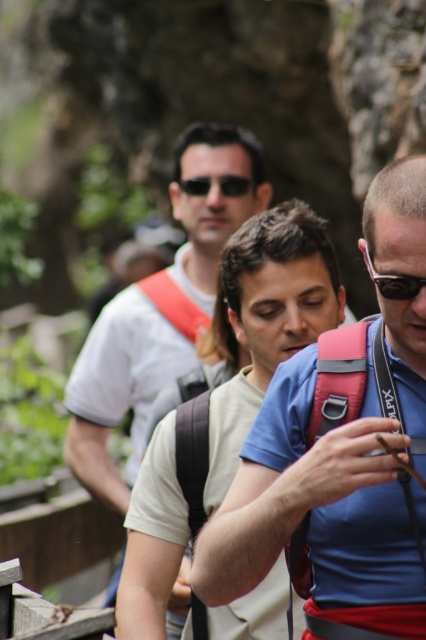
Does black plastic sunglasses at center right have a larger size compared to matte black sunglasses at center?

No, black plastic sunglasses at center right is not bigger than matte black sunglasses at center.

At what (x,y) coordinates should I click in order to perform the action: click on black plastic sunglasses at center right. Please return your answer as a coordinate pair (x, y). This screenshot has height=640, width=426. Looking at the image, I should click on (394, 282).

Which is behind, point (376, 285) or point (233, 173)?

The point (233, 173) is behind.

This screenshot has height=640, width=426. I want to click on black plastic sunglasses at center right, so [x=394, y=282].

Who is more distant from viewer, (385, 385) or (405, 298)?

The point (385, 385) is more distant.

Between matte blue shirt at center and black plastic sunglasses at center right, which one is positioned higher?

Positioned higher is black plastic sunglasses at center right.

Between point (359, 426) and point (374, 268), which one is positioned behind?

Positioned behind is point (374, 268).

Identify the location of matte blue shirt at center. This screenshot has height=640, width=426. (334, 483).

Does point (419, 524) come closer to viewer compared to point (207, 253)?

Yes, it is in front of point (207, 253).

Is point (314, 532) farther from viewer compared to point (95, 346)?

No, it is in front of (95, 346).

At what (x,y) coordinates should I click in order to perform the action: click on matte blue shirt at center. Please return your answer as a coordinate pair (x, y). This screenshot has height=640, width=426. Looking at the image, I should click on (334, 483).